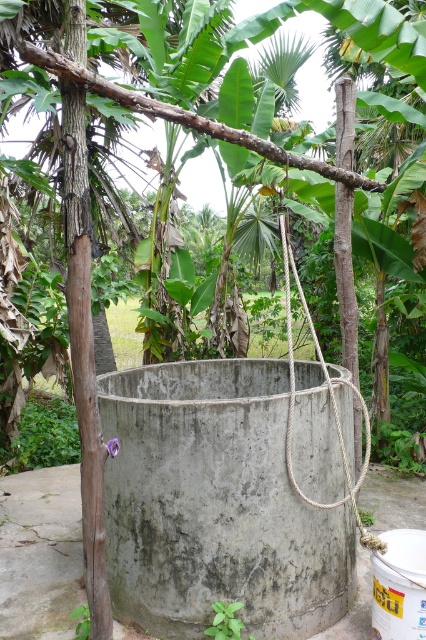
Question: Does gray concrete bucket at center have a larger size compared to roperoughrope at center?

Choices:
 (A) no
 (B) yes

Answer: (A)

Question: Which point appears closest to the camera in this image?

Choices:
 (A) (388, 508)
 (B) (368, 419)

Answer: (B)

Question: Can you confirm if gray concrete bucket at center is wider than roperoughrope at center?

Choices:
 (A) yes
 (B) no

Answer: (B)

Question: Does gray concrete bucket at center appear over roperoughrope at center?

Choices:
 (A) no
 (B) yes

Answer: (A)